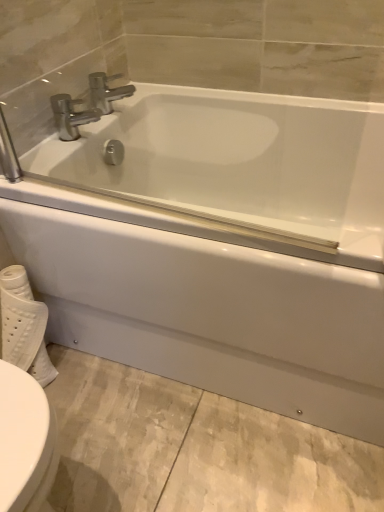
Question: Is polished chrome faucet at upper center, placed as the second tap when sorted from bottom to top, at the right side of white textured toilet paper at lower left?

Choices:
 (A) no
 (B) yes

Answer: (B)

Question: Is polished chrome faucet at upper center, which ranks as the 1th tap in top-to-bottom order, positioned before white textured toilet paper at lower left?

Choices:
 (A) no
 (B) yes

Answer: (A)

Question: Considering the relative sizes of polished chrome faucet at upper center, placed as the second tap when sorted from bottom to top, and white textured toilet paper at lower left in the image provided, is polished chrome faucet at upper center, placed as the second tap when sorted from bottom to top, shorter than white textured toilet paper at lower left?

Choices:
 (A) yes
 (B) no

Answer: (A)

Question: Is polished chrome faucet at upper center, which ranks as the 1th tap in top-to-bottom order, wider than white textured toilet paper at lower left?

Choices:
 (A) yes
 (B) no

Answer: (B)

Question: Considering the relative sizes of polished chrome faucet at upper center, placed as the second tap when sorted from bottom to top, and white textured toilet paper at lower left in the image provided, is polished chrome faucet at upper center, placed as the second tap when sorted from bottom to top, taller than white textured toilet paper at lower left?

Choices:
 (A) yes
 (B) no

Answer: (B)

Question: Is white textured toilet paper at lower left spatially inside polished chrome faucet at upper center, which ranks as the 1th tap in top-to-bottom order, or outside of it?

Choices:
 (A) outside
 (B) inside

Answer: (A)

Question: From a real-world perspective, relative to polished chrome faucet at upper center, placed as the second tap when sorted from bottom to top, is white textured toilet paper at lower left vertically above or below?

Choices:
 (A) below
 (B) above

Answer: (A)

Question: Considering their positions, is white textured toilet paper at lower left located in front of or behind polished chrome faucet at upper center, placed as the second tap when sorted from bottom to top?

Choices:
 (A) behind
 (B) front

Answer: (B)

Question: In terms of height, does white textured toilet paper at lower left look taller or shorter compared to polished chrome faucet at upper center, which ranks as the 1th tap in top-to-bottom order?

Choices:
 (A) short
 (B) tall

Answer: (B)

Question: In the image, is polished chrome faucet at upper center, placed as the second tap when sorted from bottom to top, positioned in front of or behind white textured toilet paper at lower left?

Choices:
 (A) behind
 (B) front

Answer: (A)

Question: In the image, is polished chrome faucet at upper center, placed as the second tap when sorted from bottom to top, on the left side or the right side of white textured toilet paper at lower left?

Choices:
 (A) right
 (B) left

Answer: (A)

Question: Which is correct: polished chrome faucet at upper center, placed as the second tap when sorted from bottom to top, is inside white textured toilet paper at lower left, or outside of it?

Choices:
 (A) inside
 (B) outside

Answer: (B)

Question: Considering the positions of point pyautogui.click(x=117, y=94) and point pyautogui.click(x=46, y=366), is point pyautogui.click(x=117, y=94) closer or farther from the camera than point pyautogui.click(x=46, y=366)?

Choices:
 (A) closer
 (B) farther

Answer: (B)

Question: Considering their positions, is polished chrome faucet at upper left, arranged as the 2th tap when viewed from the top, located in front of or behind polished chrome faucet at upper center, which ranks as the 1th tap in top-to-bottom order?

Choices:
 (A) behind
 (B) front

Answer: (B)

Question: From a real-world perspective, is polished chrome faucet at upper left, the 1th tap in the bottom-to-top sequence, physically located above or below polished chrome faucet at upper center, which ranks as the 1th tap in top-to-bottom order?

Choices:
 (A) below
 (B) above

Answer: (A)